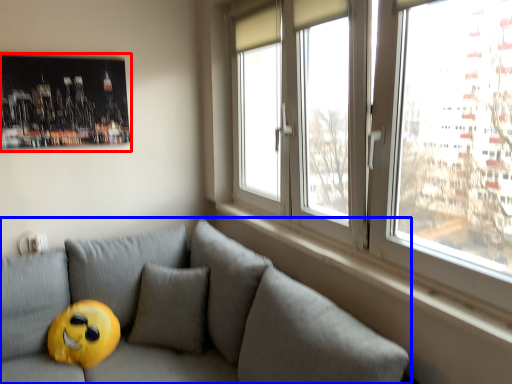
Question: Which of the following is the closest to the observer, picture frame (highlighted by a red box) or studio couch (highlighted by a blue box)?

Choices:
 (A) picture frame
 (B) studio couch

Answer: (B)